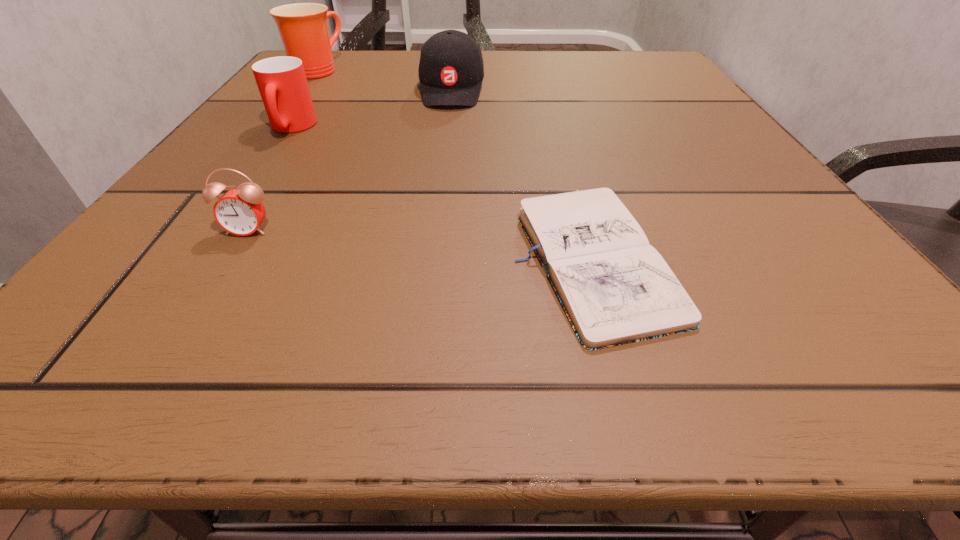
Locate an element on the screen. unoccupied position between the baseball cap and the nearer cup is located at coordinates (372, 109).

Where is `vacant region between the fourth tallest object and the tallest object`? The width and height of the screenshot is (960, 540). vacant region between the fourth tallest object and the tallest object is located at coordinates (282, 150).

Where is `object that stands as the second closest to the third farthest object`? Image resolution: width=960 pixels, height=540 pixels. object that stands as the second closest to the third farthest object is located at coordinates (451, 70).

Find the location of a particular element. The height and width of the screenshot is (540, 960). object that is the third closest one to the baseball cap is located at coordinates (615, 288).

Locate an element on the screen. free space that satisfies the following two spatial constraints: 1. with a logo on the front of the second object from right to left; 2. on the right side of the rightmost object is located at coordinates (432, 255).

This screenshot has height=540, width=960. Find the location of `vacant region that satisfies the following two spatial constraints: 1. on the side of the nearer cup with the handle; 2. on the right side of the shortest object`. vacant region that satisfies the following two spatial constraints: 1. on the side of the nearer cup with the handle; 2. on the right side of the shortest object is located at coordinates (205, 255).

Locate an element on the screen. The height and width of the screenshot is (540, 960). vacant space that satisfies the following two spatial constraints: 1. with a logo on the front of the baseball cap; 2. on the left side of the shortest object is located at coordinates (432, 255).

At what (x,y) coordinates should I click in order to perform the action: click on free space that satisfies the following two spatial constraints: 1. on the clock face of the notebook; 2. on the right side of the fourth tallest object. Please return your answer as a coordinate pair (x, y). The image size is (960, 540). Looking at the image, I should click on (233, 255).

I want to click on free space in the image that satisfies the following two spatial constraints: 1. with a logo on the front of the notebook; 2. on the right side of the baseball cap, so click(432, 255).